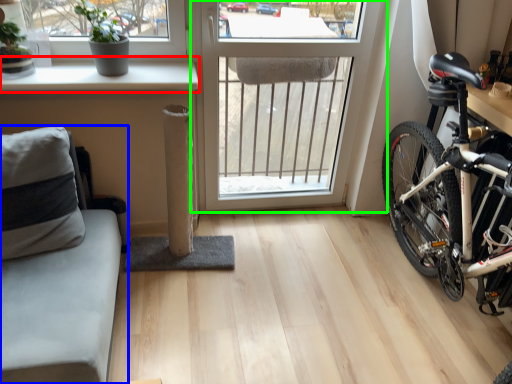
Question: Which object is the farthest from window sill (highlighted by a red box)? Choose among these: studio couch (highlighted by a blue box) or window (highlighted by a green box).

Choices:
 (A) studio couch
 (B) window

Answer: (B)